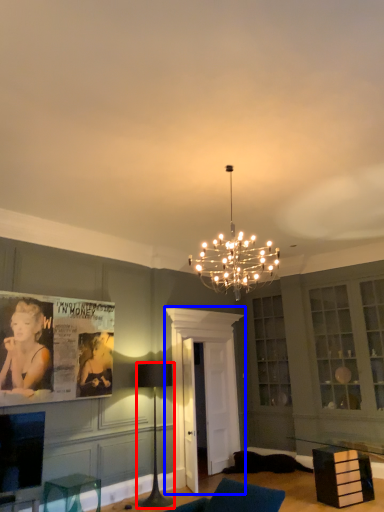
Question: Among these objects, which one is farthest to the camera, lamp (highlighted by a red box) or glass door (highlighted by a blue box)?

Choices:
 (A) lamp
 (B) glass door

Answer: (B)